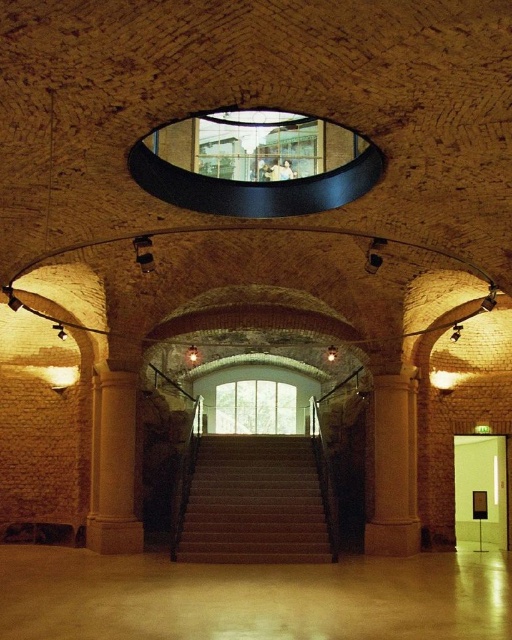
Does sanded concrete floor at lower center have a greater width compared to smooth beige column at center?

Correct, the width of sanded concrete floor at lower center exceeds that of smooth beige column at center.

Which is above, sanded concrete floor at lower center or smooth beige column at center?

smooth beige column at center is higher up.

Is point (337, 588) closer to viewer compared to point (98, 524)?

Yes, point (337, 588) is in front of point (98, 524).

Find the location of a particular element. sanded concrete floor at lower center is located at coordinates (251, 596).

Is point (195, 576) farther from camera compared to point (260, 557)?

No, (195, 576) is closer to viewer.

Between point (432, 625) and point (210, 502), which one is positioned behind?

Point (210, 502)

Who is more forward, (273, 627) or (251, 513)?

Point (273, 627) is in front.

Where is `sanded concrete floor at lower center`? This screenshot has height=640, width=512. sanded concrete floor at lower center is located at coordinates (251, 596).

Between smooth beige stairs at center and smooth beige column at center, which one has more height?

smooth beige column at center is taller.

Who is more distant from viewer, (267, 440) or (112, 483)?

The point (267, 440) is more distant.

Locate an element on the screen. The image size is (512, 640). smooth beige stairs at center is located at coordinates (254, 502).